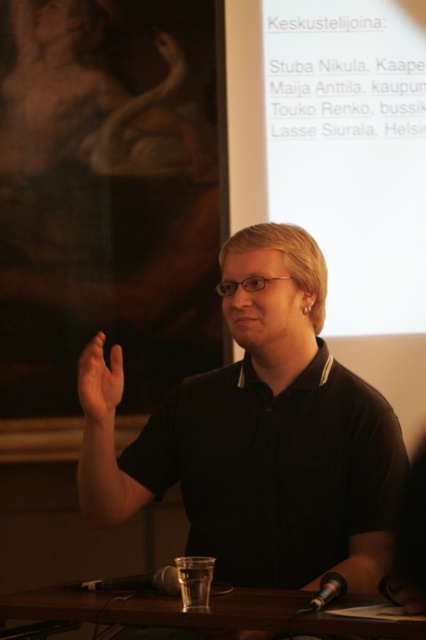
Question: Considering the real-world distances, which object is closest to the white matte projection screen at upper center?

Choices:
 (A) black matte shirt at center
 (B) transparent glass at lower center
 (C) black matte microphone at lower center
 (D) metallic silver microphone at lower center

Answer: (A)

Question: Can you confirm if black matte shirt at center is wider than transparent glass at lower center?

Choices:
 (A) no
 (B) yes

Answer: (A)

Question: Is white matte projection screen at upper center wider than transparent glass at lower center?

Choices:
 (A) yes
 (B) no

Answer: (B)

Question: Which point is closer to the camera?

Choices:
 (A) black matte shirt at center
 (B) metallic silver microphone at lower center
 (C) black matte microphone at lower center
 (D) smooth skin hand at center

Answer: (B)

Question: Can you confirm if transparent glass at lower center is bigger than smooth skin hand at center?

Choices:
 (A) no
 (B) yes

Answer: (B)

Question: Considering the real-world distances, which object is closest to the transparent glass at lower center?

Choices:
 (A) smooth skin hand at center
 (B) white matte projection screen at upper center

Answer: (A)